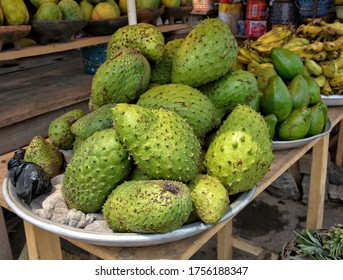
The width and height of the screenshot is (343, 280). Identify the location of wooden supports. (319, 152), (319, 171), (319, 213), (225, 232), (225, 251), (39, 236), (39, 256).